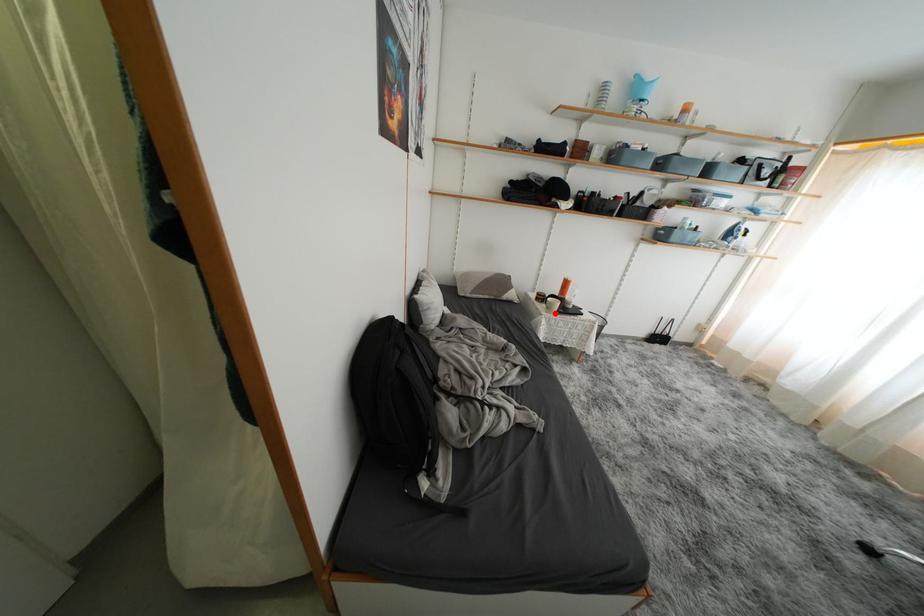
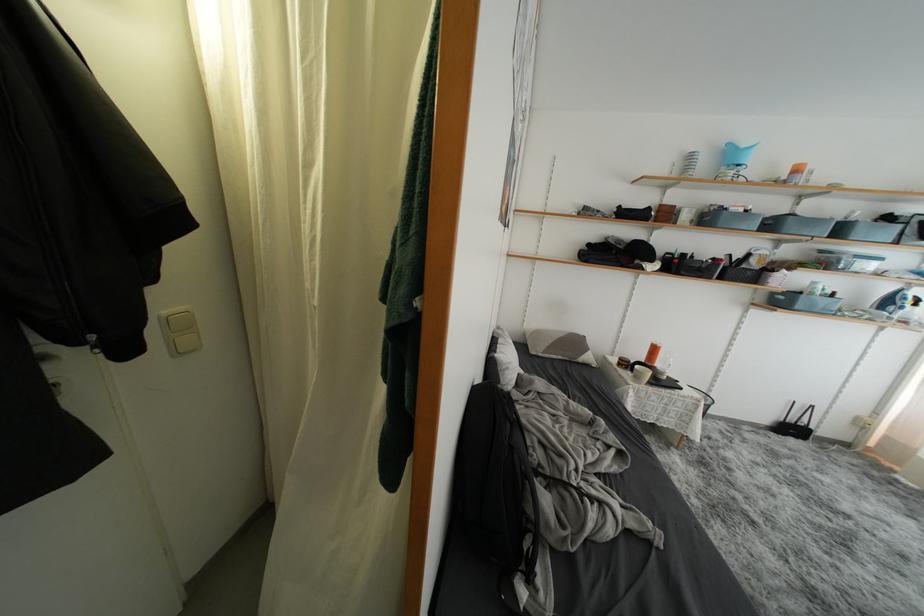
Locate, in the second image, the point that corresponds to the highlighted location in the first image.

(642, 382)